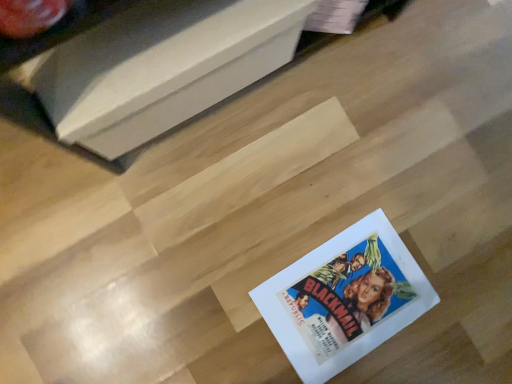
What are the coordinates of `free spot above white paper at lower center (from a real-world perspective)` in the screenshot? It's located at (128, 47).